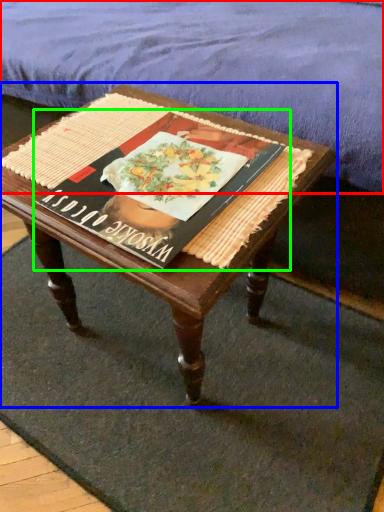
Question: Considering the real-world distances, which object is farthest from mattress (highlighted by a red box)? coffee table (highlighted by a blue box) or paperback book (highlighted by a green box)?

Choices:
 (A) coffee table
 (B) paperback book

Answer: (B)